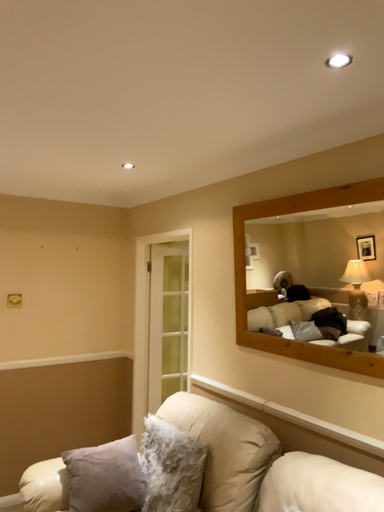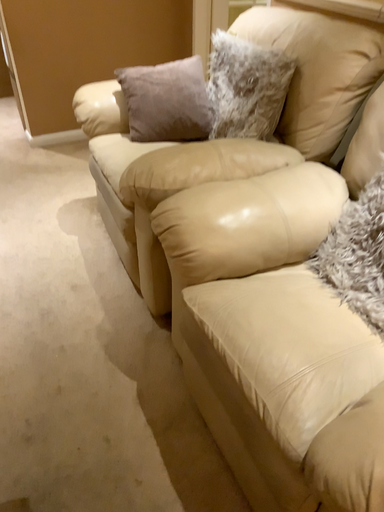
Question: Which way did the camera rotate in the video?

Choices:
 (A) rotated left
 (B) rotated right

Answer: (A)